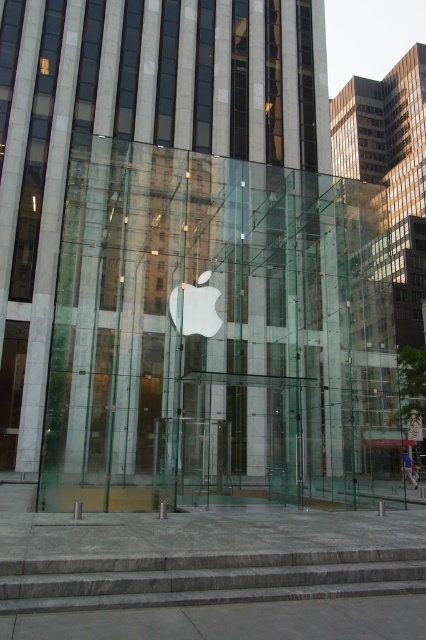
Question: Where is transparent glass apple store at center located in relation to gray stone stairs at lower center in the image?

Choices:
 (A) above
 (B) below

Answer: (B)

Question: Can you confirm if transparent glass apple store at center is thinner than gray stone stairs at lower center?

Choices:
 (A) no
 (B) yes

Answer: (A)

Question: Is transparent glass apple store at center closer to the viewer compared to gray stone stairs at lower center?

Choices:
 (A) no
 (B) yes

Answer: (A)

Question: Which of the following is the farthest from the observer?

Choices:
 (A) (92, 493)
 (B) (229, 576)

Answer: (A)

Question: Among these objects, which one is nearest to the camera?

Choices:
 (A) transparent glass apple store at center
 (B) gray stone stairs at lower center

Answer: (B)

Question: Which object appears closest to the camera in this image?

Choices:
 (A) gray stone stairs at lower center
 (B) transparent glass apple store at center

Answer: (A)